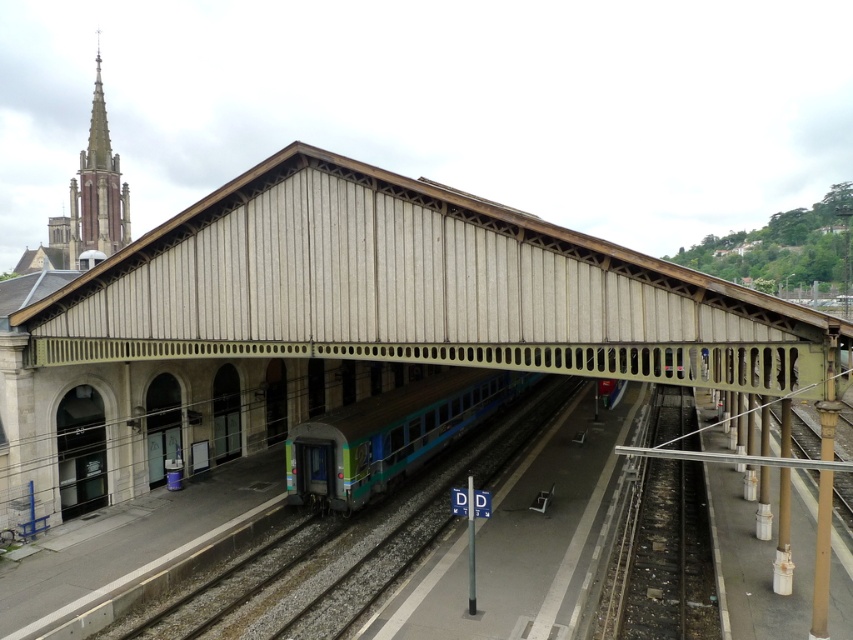
Question: Is smooth concrete train track at lower right above teal glossy train at center?

Choices:
 (A) yes
 (B) no

Answer: (B)

Question: Is smooth concrete train track at lower right thinner than teal glossy train at center?

Choices:
 (A) no
 (B) yes

Answer: (A)

Question: Is smooth concrete train track at lower right further to the viewer compared to teal glossy train at center?

Choices:
 (A) no
 (B) yes

Answer: (A)

Question: Which of the following is the farthest from the observer?

Choices:
 (A) (692, 436)
 (B) (286, 483)

Answer: (A)

Question: Which point is farther from the camera taking this photo?

Choices:
 (A) (442, 445)
 (B) (697, 595)

Answer: (A)